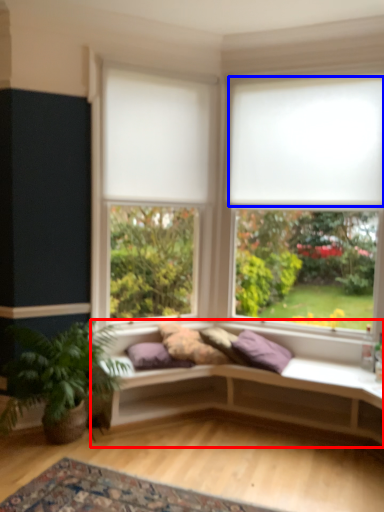
Question: Among these objects, which one is farthest to the camera, studio couch (highlighted by a red box) or blind (highlighted by a blue box)?

Choices:
 (A) studio couch
 (B) blind

Answer: (B)